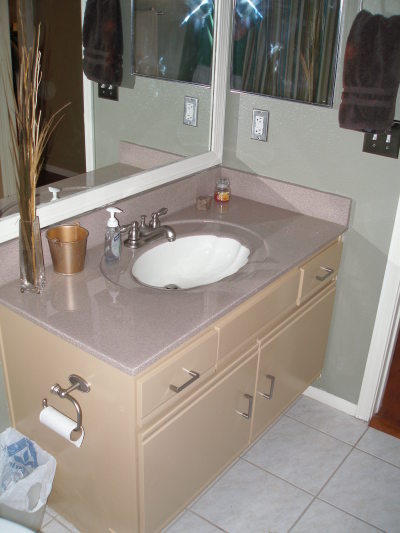
Image resolution: width=400 pixels, height=533 pixels. What are the coordinates of `drawers` in the screenshot? It's located at (203, 364), (313, 280).